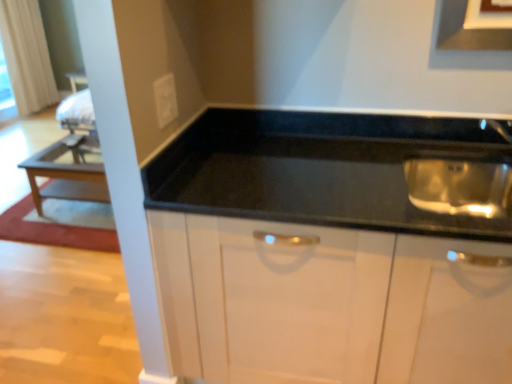
Question: Does matte black exhaust hood at upper center have a greater width compared to wooden table at left?

Choices:
 (A) no
 (B) yes

Answer: (A)

Question: Are matte black exhaust hood at upper center and wooden table at left far apart?

Choices:
 (A) yes
 (B) no

Answer: (A)

Question: Considering the relative positions of matte black exhaust hood at upper center and wooden table at left in the image provided, is matte black exhaust hood at upper center to the left of wooden table at left from the viewer's perspective?

Choices:
 (A) no
 (B) yes

Answer: (A)

Question: Could you tell me if matte black exhaust hood at upper center is turned towards wooden table at left?

Choices:
 (A) yes
 (B) no

Answer: (B)

Question: From the image's perspective, is matte black exhaust hood at upper center below wooden table at left?

Choices:
 (A) yes
 (B) no

Answer: (B)

Question: Considering the positions of white fabric curtain at upper left and wooden table at left in the image, is white fabric curtain at upper left bigger or smaller than wooden table at left?

Choices:
 (A) small
 (B) big

Answer: (B)

Question: Is white fabric curtain at upper left taller or shorter than wooden table at left?

Choices:
 (A) tall
 (B) short

Answer: (A)

Question: Is point (45, 67) positioned closer to the camera than point (64, 180)?

Choices:
 (A) farther
 (B) closer

Answer: (A)

Question: In terms of width, does white fabric curtain at upper left look wider or thinner when compared to wooden table at left?

Choices:
 (A) thin
 (B) wide

Answer: (A)

Question: In terms of height, does black glossy cabinet at center look taller or shorter compared to wooden table at left?

Choices:
 (A) tall
 (B) short

Answer: (A)

Question: In the image, is black glossy cabinet at center positioned in front of or behind wooden table at left?

Choices:
 (A) front
 (B) behind

Answer: (A)

Question: Based on their sizes in the image, would you say black glossy cabinet at center is bigger or smaller than wooden table at left?

Choices:
 (A) big
 (B) small

Answer: (A)

Question: Would you say black glossy cabinet at center is to the left or to the right of wooden table at left in the picture?

Choices:
 (A) left
 (B) right

Answer: (B)

Question: Considering the relative positions of wooden table at left and white fabric curtain at upper left in the image provided, is wooden table at left to the left or to the right of white fabric curtain at upper left?

Choices:
 (A) right
 (B) left

Answer: (A)

Question: Is wooden table at left in front of or behind white fabric curtain at upper left in the image?

Choices:
 (A) front
 (B) behind

Answer: (A)